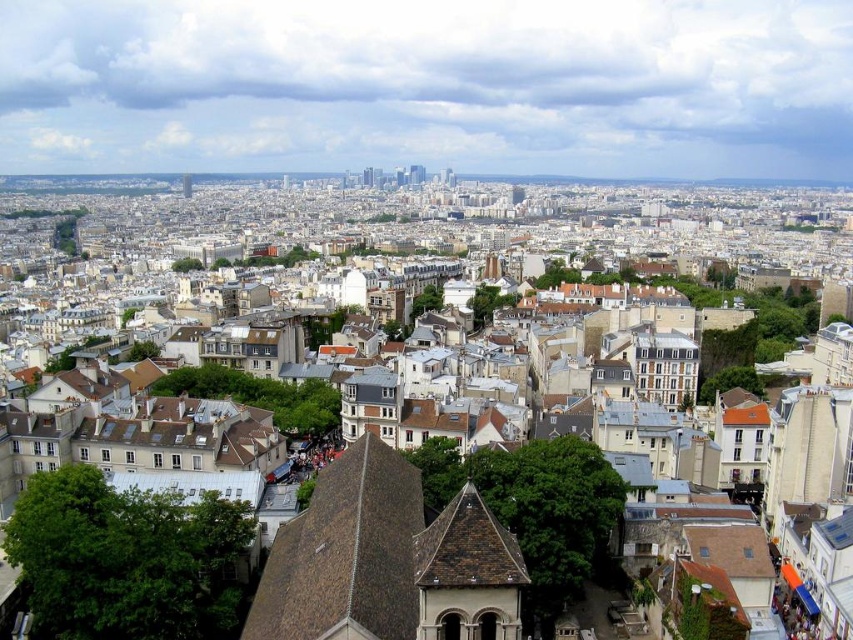
You are an architect analyzing the urban layout. You observe the brown tiled roofs at center and the smooth concrete tower at upper center. Which structure occupies a larger horizontal space in the scene?

The brown tiled roofs at center occupy a larger horizontal space than the smooth concrete tower at upper center because their width surpasses the tower.

You are a city planner analyzing the urban layout. You observe a point marked at coordinates (x=421, y=240). Based on the scene description, what architectural feature does this point indicate?

The point at coordinates (x=421, y=240) marks brown tiled roofs at center.